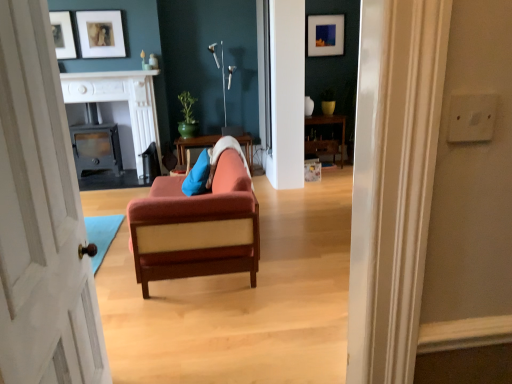
Question: Is blue fabric pillow at center bigger or smaller than green glossy pot at upper center?

Choices:
 (A) big
 (B) small

Answer: (B)

Question: In terms of width, does blue fabric pillow at center look wider or thinner when compared to green glossy pot at upper center?

Choices:
 (A) thin
 (B) wide

Answer: (A)

Question: Estimate the real-world distances between objects in this image. Which object is closer to the white glossy vase at center?

Choices:
 (A) white glossy fireplace at upper center
 (B) matte black wood stove at center, arranged as the 2th fireplace when viewed from the left
 (C) blue fabric pillow at center
 (D) matte white picture frame at upper left, which is counted as the 2th picture frame, starting from the back
 (E) wooden dresser at center

Answer: (E)

Question: Which of these objects is positioned closest to the white plastic lamp at upper center?

Choices:
 (A) white glossy fireplace at upper center
 (B) matte black wood stove at center, the 1th fireplace from the right
 (C) matte orange couch at center
 (D) wooden dresser at center
 (E) matte white picture frame at upper left, the 3th picture frame from the back

Answer: (A)